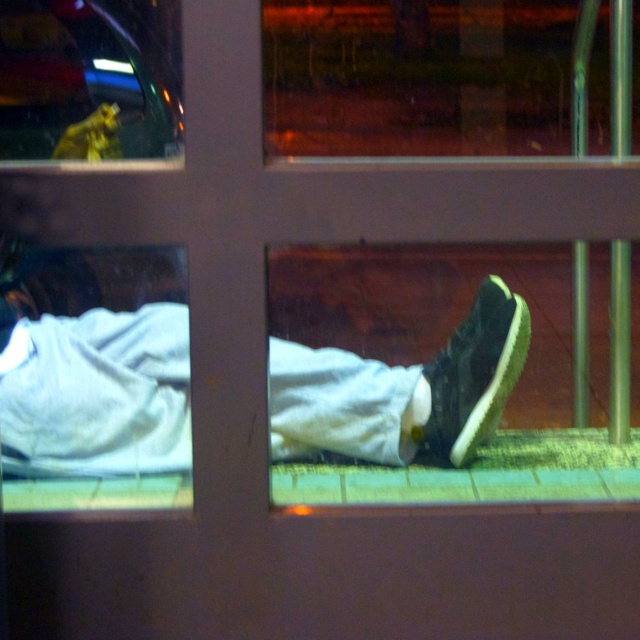
You are a passenger in a moving vehicle and notice the clear glass window at upper left and the black suede shoe at lower right. Which object is closer to you, the observer?

The black suede shoe at lower right is closer to you because it is positioned behind the clear glass window at upper left, meaning the shoe is between you and the window.

You are a security camera monitoring the scene. The white matte pants at lower center and the black suede shoe at lower right are visible. Which object is wider in the image?

The white matte pants at lower center might be wider than the black suede shoe at lower right according to the description.